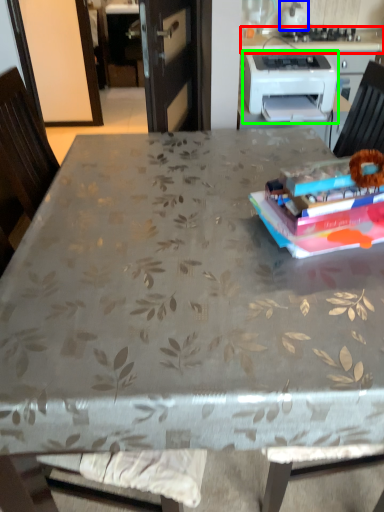
Question: Which is farther away from counter top (highlighted by a red box)? kitchen appliance (highlighted by a blue box) or printer (highlighted by a green box)?

Choices:
 (A) kitchen appliance
 (B) printer

Answer: (B)